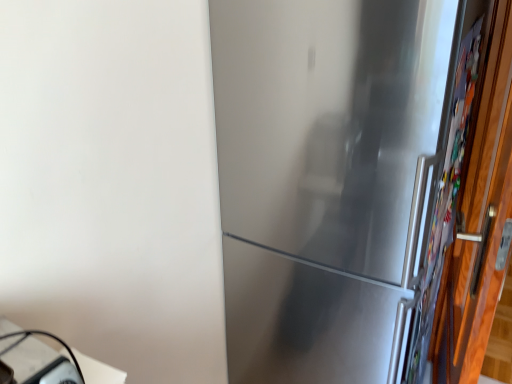
Question: Does white glossy table at lower left contain satin silver refrigerator at center?

Choices:
 (A) yes
 (B) no

Answer: (B)

Question: Is white glossy table at lower left closer to the viewer compared to satin silver refrigerator at center?

Choices:
 (A) yes
 (B) no

Answer: (A)

Question: Would you consider white glossy table at lower left to be distant from satin silver refrigerator at center?

Choices:
 (A) yes
 (B) no

Answer: (B)

Question: Could you tell me if white glossy table at lower left is turned towards satin silver refrigerator at center?

Choices:
 (A) no
 (B) yes

Answer: (A)

Question: From the image's perspective, would you say white glossy table at lower left is shown under satin silver refrigerator at center?

Choices:
 (A) no
 (B) yes

Answer: (B)

Question: Would you say satin silver refrigerator at center is to the left or to the right of wooden door at right in the picture?

Choices:
 (A) right
 (B) left

Answer: (B)

Question: Considering their positions, is satin silver refrigerator at center located in front of or behind wooden door at right?

Choices:
 (A) front
 (B) behind

Answer: (B)

Question: Does point (368, 273) appear closer or farther from the camera than point (480, 223)?

Choices:
 (A) closer
 (B) farther

Answer: (B)

Question: Is satin silver refrigerator at center bigger or smaller than wooden door at right?

Choices:
 (A) small
 (B) big

Answer: (B)

Question: Considering the positions of wooden door at right and satin silver refrigerator at center in the image, is wooden door at right wider or thinner than satin silver refrigerator at center?

Choices:
 (A) thin
 (B) wide

Answer: (A)

Question: In terms of height, does wooden door at right look taller or shorter compared to satin silver refrigerator at center?

Choices:
 (A) tall
 (B) short

Answer: (B)

Question: Is wooden door at right inside or outside of satin silver refrigerator at center?

Choices:
 (A) outside
 (B) inside

Answer: (A)

Question: From the image's perspective, relative to satin silver refrigerator at center, is wooden door at right above or below?

Choices:
 (A) above
 (B) below

Answer: (B)

Question: From the image's perspective, relative to white glossy table at lower left, is satin silver refrigerator at center above or below?

Choices:
 (A) above
 (B) below

Answer: (A)

Question: From a real-world perspective, is satin silver refrigerator at center positioned above or below white glossy table at lower left?

Choices:
 (A) above
 (B) below

Answer: (A)